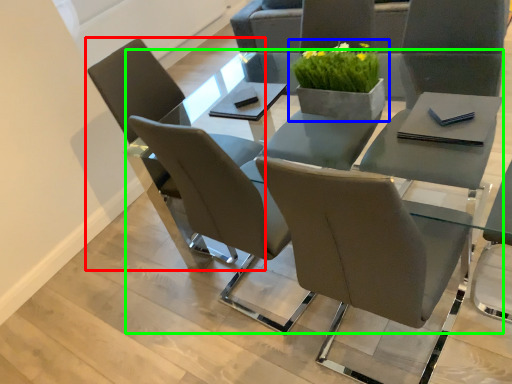
Question: Considering the real-world distances, which object is farthest from chair (highlighted by a red box)? houseplant (highlighted by a blue box) or round table (highlighted by a green box)?

Choices:
 (A) houseplant
 (B) round table

Answer: (B)